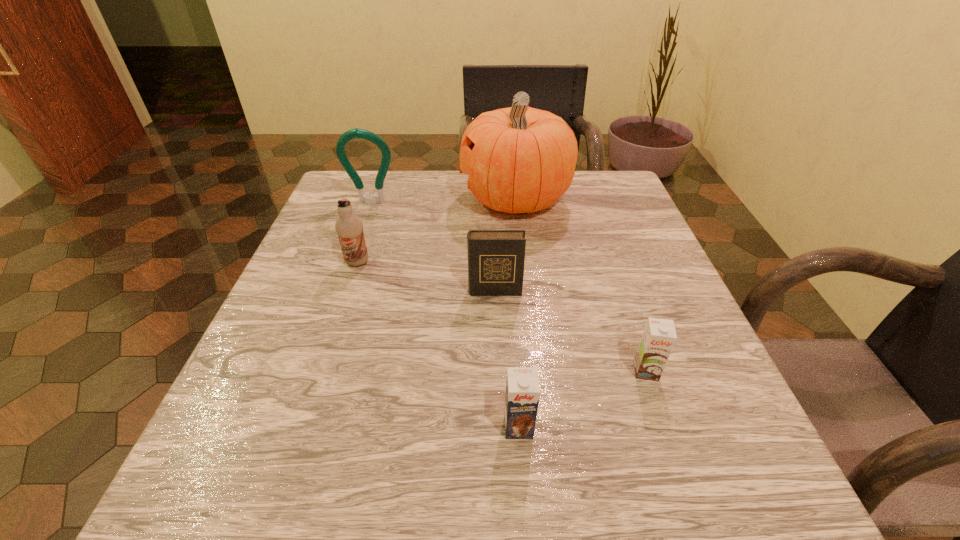
In order to click on pumpkin present at the right edge in this screenshot , I will do `click(519, 159)`.

The height and width of the screenshot is (540, 960). Identify the location of chocolate milk that is at the right edge. click(x=659, y=336).

Find the location of a particular element. Image resolution: width=960 pixels, height=540 pixels. object that is at the far left corner is located at coordinates (357, 133).

Identify the location of object that is at the far right corner. (519, 159).

In the image, there is a desktop. What are the coordinates of `vacant space at the far edge` in the screenshot? It's located at (409, 174).

The height and width of the screenshot is (540, 960). Find the location of `vacant region at the near edge of the desktop`. vacant region at the near edge of the desktop is located at coordinates (598, 460).

In the image, there is a desktop. Where is `vacant space at the left edge`? The height and width of the screenshot is (540, 960). vacant space at the left edge is located at coordinates (263, 352).

In the image, there is a desktop. Identify the location of vacant area at the right edge. (597, 231).

This screenshot has width=960, height=540. In the image, there is a desktop. What are the coordinates of `free space at the far left corner` in the screenshot? It's located at (399, 181).

This screenshot has height=540, width=960. I want to click on vacant space at the far right corner of the desktop, so click(612, 175).